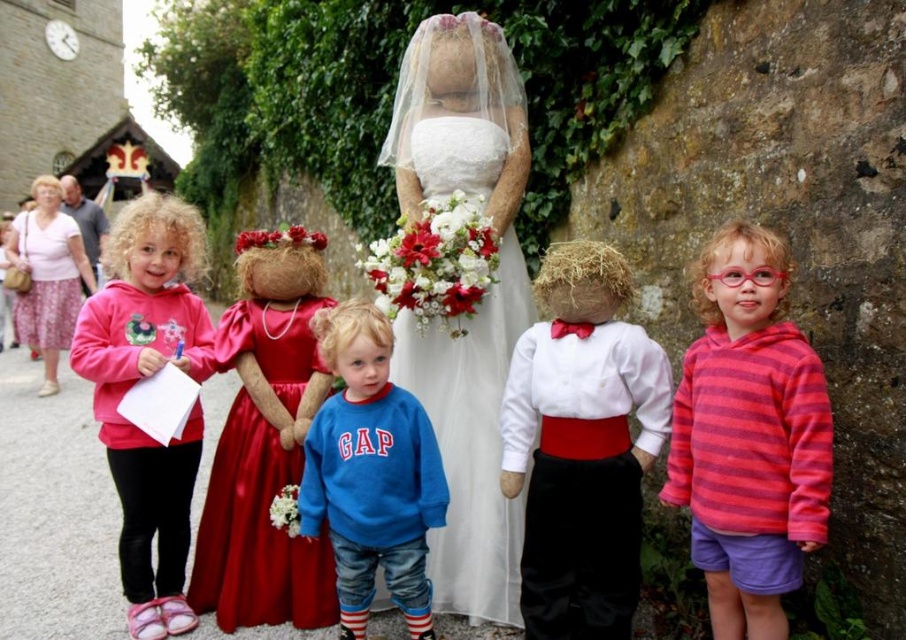
Which is more to the right, pink fleece hoodie at center or satin red dress at center?

satin red dress at center is more to the right.

Describe the element at coordinates (146, 378) in the screenshot. I see `pink fleece hoodie at center` at that location.

In order to click on pink fleece hoodie at center in this screenshot , I will do (146, 378).

Does white satin dress at center come in front of white cotton shirt at center?

No, white satin dress at center is further to the viewer.

Is point (403, 355) farther from camera compared to point (595, 620)?

Yes, it is behind point (595, 620).

Between point (446, 184) and point (646, 337), which one is positioned in front?

Point (646, 337) is in front.

Image resolution: width=906 pixels, height=640 pixels. Identify the location of white satin dress at center. (477, 305).

What do you see at coordinates (582, 444) in the screenshot?
I see `white cotton shirt at center` at bounding box center [582, 444].

Locate an element on the screen. The width and height of the screenshot is (906, 640). white cotton shirt at center is located at coordinates (582, 444).